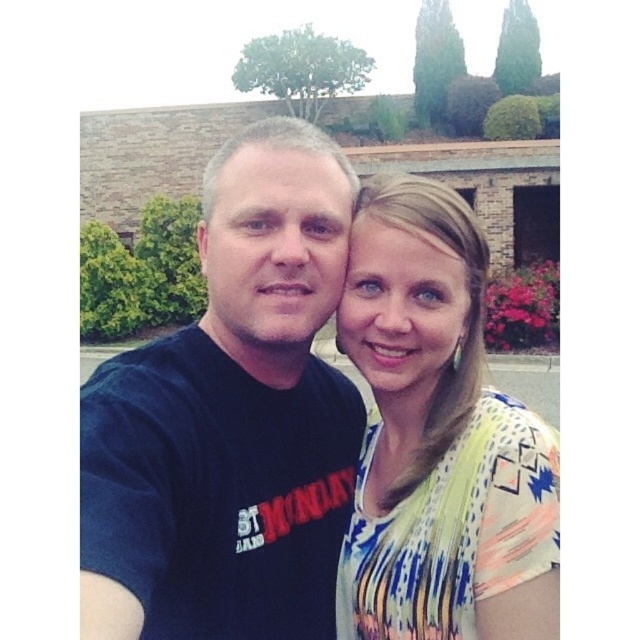
Does dark blue t-shirt at center have a larger size compared to multicolored printed blouse at center?

No, dark blue t-shirt at center is not bigger than multicolored printed blouse at center.

Can you confirm if dark blue t-shirt at center is positioned below multicolored printed blouse at center?

No.

Where is `dark blue t-shirt at center`? This screenshot has width=640, height=640. dark blue t-shirt at center is located at coordinates (230, 419).

Identify the location of dark blue t-shirt at center. (230, 419).